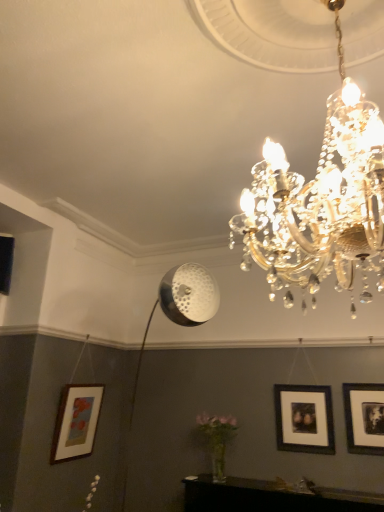
Question: Considering the relative positions of wooden matte picture frame at lower left, the 3th picture frame positioned from the right, and black matte picture frame at center right, acting as the second picture frame starting from the left, in the image provided, is wooden matte picture frame at lower left, the 3th picture frame positioned from the right, to the right of black matte picture frame at center right, acting as the second picture frame starting from the left, from the viewer's perspective?

Choices:
 (A) yes
 (B) no

Answer: (B)

Question: Is wooden matte picture frame at lower left, the 3th picture frame positioned from the right, surrounding black matte picture frame at center right, which appears as the second picture frame when viewed from the right?

Choices:
 (A) yes
 (B) no

Answer: (B)

Question: Is wooden matte picture frame at lower left, the first picture frame when ordered from left to right, looking in the opposite direction of black matte picture frame at center right, which appears as the second picture frame when viewed from the right?

Choices:
 (A) no
 (B) yes

Answer: (A)

Question: Does wooden matte picture frame at lower left, the first picture frame when ordered from left to right, come behind black matte picture frame at center right, which appears as the second picture frame when viewed from the right?

Choices:
 (A) yes
 (B) no

Answer: (A)

Question: From a real-world perspective, is wooden matte picture frame at lower left, the 3th picture frame positioned from the right, positioned under black matte picture frame at center right, acting as the second picture frame starting from the left, based on gravity?

Choices:
 (A) no
 (B) yes

Answer: (B)

Question: Is wooden matte picture frame at lower left, the 3th picture frame positioned from the right, outside of black matte picture frame at center right, acting as the second picture frame starting from the left?

Choices:
 (A) yes
 (B) no

Answer: (A)

Question: Is black matte picture frame at center right, which appears as the second picture frame when viewed from the right, positioned far away from black matte picture frame at right, which appears as the first picture frame when viewed from the right?

Choices:
 (A) yes
 (B) no

Answer: (B)

Question: Is black matte picture frame at center right, acting as the second picture frame starting from the left, taller than black matte picture frame at right, which appears as the first picture frame when viewed from the right?

Choices:
 (A) yes
 (B) no

Answer: (A)

Question: From a real-world perspective, is black matte picture frame at center right, which appears as the second picture frame when viewed from the right, located beneath black matte picture frame at right, positioned as the 3th picture frame in left-to-right order?

Choices:
 (A) yes
 (B) no

Answer: (A)

Question: Can black matte picture frame at right, positioned as the 3th picture frame in left-to-right order, be found inside black matte picture frame at center right, which appears as the second picture frame when viewed from the right?

Choices:
 (A) yes
 (B) no

Answer: (B)

Question: From the image's perspective, is black matte picture frame at center right, which appears as the second picture frame when viewed from the right, on black matte picture frame at right, positioned as the 3th picture frame in left-to-right order?

Choices:
 (A) no
 (B) yes

Answer: (A)

Question: Is black matte picture frame at center right, acting as the second picture frame starting from the left, oriented towards black matte picture frame at right, positioned as the 3th picture frame in left-to-right order?

Choices:
 (A) yes
 (B) no

Answer: (B)

Question: From the image's perspective, is black matte picture frame at right, positioned as the 3th picture frame in left-to-right order, above wooden matte picture frame at lower left, the first picture frame when ordered from left to right?

Choices:
 (A) yes
 (B) no

Answer: (A)